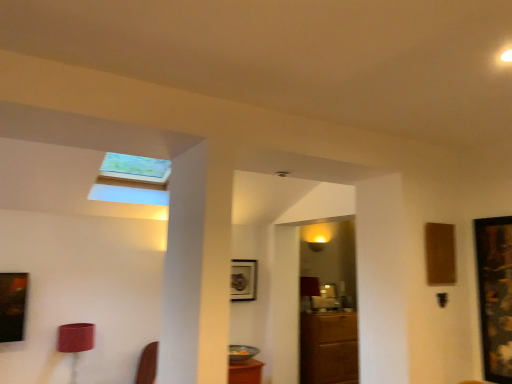
Question: Is brown wooden cabinet at center behind wooden framed artwork at right, arranged as the 2th picture frame when viewed from the back?

Choices:
 (A) no
 (B) yes

Answer: (B)

Question: Is brown wooden cabinet at center outside of wooden framed artwork at right, the 2th picture frame positioned from the left?

Choices:
 (A) no
 (B) yes

Answer: (B)

Question: Is brown wooden cabinet at center facing towards wooden framed artwork at right, acting as the 1th picture frame starting from the right?

Choices:
 (A) yes
 (B) no

Answer: (A)

Question: Considering the relative sizes of brown wooden cabinet at center and wooden framed artwork at right, the 2th picture frame positioned from the left, in the image provided, is brown wooden cabinet at center bigger than wooden framed artwork at right, the 2th picture frame positioned from the left,?

Choices:
 (A) yes
 (B) no

Answer: (A)

Question: Is wooden framed artwork at right, the 2th picture frame positioned from the left, surrounded by brown wooden cabinet at center?

Choices:
 (A) no
 (B) yes

Answer: (A)

Question: From a real-world perspective, relative to metallic silver picture frame at center, which is counted as the 1th picture frame, starting from the back, is wooden framed artwork at right, acting as the 1th picture frame starting from the right, vertically above or below?

Choices:
 (A) above
 (B) below

Answer: (B)

Question: Based on their sizes in the image, would you say wooden framed artwork at right, the first picture frame when ordered from front to back, is bigger or smaller than metallic silver picture frame at center, acting as the first picture frame starting from the left?

Choices:
 (A) small
 (B) big

Answer: (B)

Question: In the image, is wooden framed artwork at right, acting as the 1th picture frame starting from the right, positioned in front of or behind metallic silver picture frame at center, placed as the second picture frame when sorted from front to back?

Choices:
 (A) front
 (B) behind

Answer: (A)

Question: Is point click(x=508, y=221) positioned closer to the camera than point click(x=244, y=266)?

Choices:
 (A) closer
 (B) farther

Answer: (A)

Question: Based on their sizes in the image, would you say brown wooden cabinet at center is bigger or smaller than wooden framed artwork at right, the 2th picture frame positioned from the left?

Choices:
 (A) big
 (B) small

Answer: (A)

Question: Looking at their shapes, would you say brown wooden cabinet at center is wider or thinner than wooden framed artwork at right, arranged as the 2th picture frame when viewed from the back?

Choices:
 (A) thin
 (B) wide

Answer: (B)

Question: Would you say brown wooden cabinet at center is to the left or to the right of wooden framed artwork at right, acting as the 1th picture frame starting from the right, in the picture?

Choices:
 (A) right
 (B) left

Answer: (B)

Question: From a real-world perspective, is brown wooden cabinet at center above or below wooden framed artwork at right, acting as the 1th picture frame starting from the right?

Choices:
 (A) below
 (B) above

Answer: (A)

Question: Looking at their shapes, would you say wooden framed artwork at right, the 2th picture frame positioned from the left, is wider or thinner than brown wooden cabinet at center?

Choices:
 (A) thin
 (B) wide

Answer: (A)

Question: Do you think wooden framed artwork at right, the 2th picture frame positioned from the left, is within brown wooden cabinet at center, or outside of it?

Choices:
 (A) outside
 (B) inside

Answer: (A)